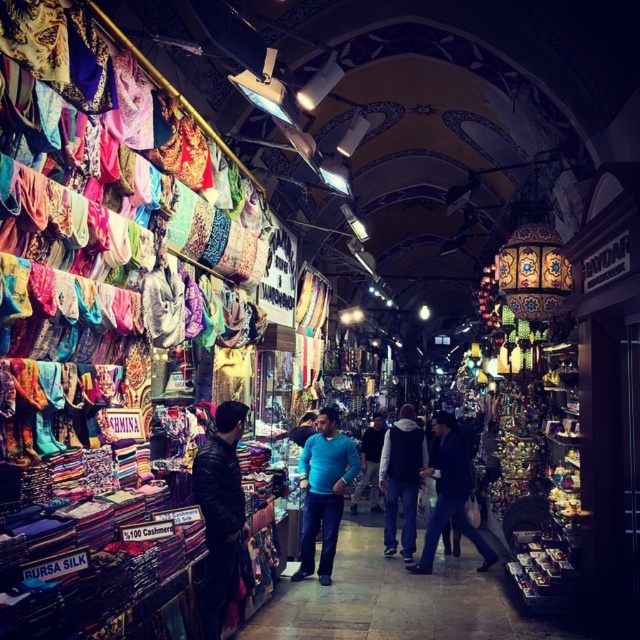
Question: Does black leather jacket at center have a larger size compared to blue cotton shirt at center?

Choices:
 (A) yes
 (B) no

Answer: (B)

Question: Is black leather jacket at center positioned before blue matte shirt at center?

Choices:
 (A) no
 (B) yes

Answer: (B)

Question: Which object is farther from the camera taking this photo?

Choices:
 (A) black leather jacket at center
 (B) matte blue jeans at center
 (C) blue denim jacket at center

Answer: (C)

Question: Does blue denim jacket at center appear on the right side of blue cotton shirt at center?

Choices:
 (A) no
 (B) yes

Answer: (B)

Question: Estimate the real-world distances between objects in this image. Which object is farther from the matte blue jeans at center?

Choices:
 (A) black leather jacket at center
 (B) dark blue jeans at center
 (C) blue matte shirt at center
 (D) blue cotton shirt at center

Answer: (D)

Question: Which object is closer to the camera taking this photo?

Choices:
 (A) blue matte shirt at center
 (B) black leather jacket at center

Answer: (B)